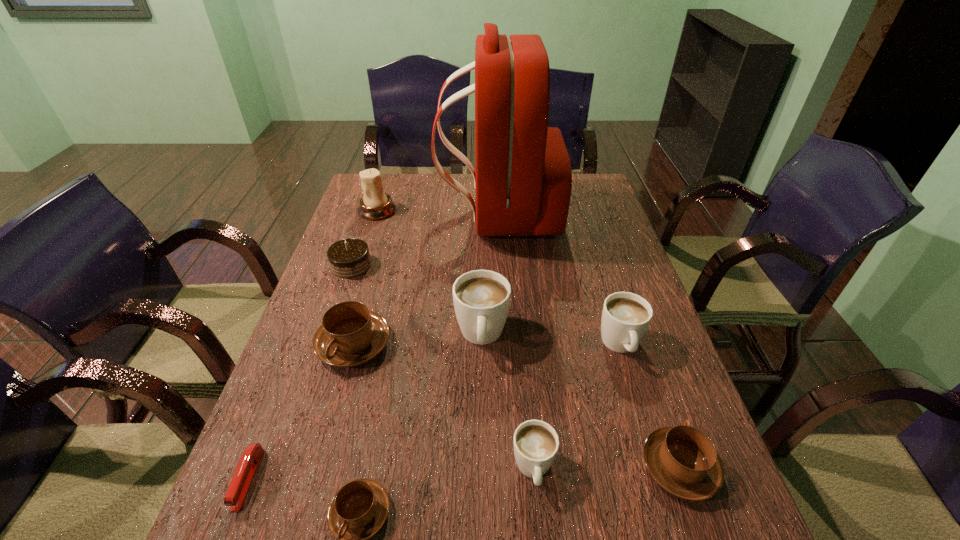
The image size is (960, 540). I want to click on vacant area that lies between the biggest brown cappuccino and the nearest white cappuccino, so click(444, 406).

Image resolution: width=960 pixels, height=540 pixels. In order to click on vacant area that lies between the stapler and the nearest white cappuccino in this screenshot , I will do `click(391, 474)`.

Where is `object that can be found as the third closest to the ninth tallest object`? object that can be found as the third closest to the ninth tallest object is located at coordinates (350, 335).

You are a GUI agent. You are given a task and a screenshot of the screen. Output one action in this format:
    pyautogui.click(x=<x>, y=<y>)
    Task: Click on the object that stands as the eighth closest to the white candle holder
    The height and width of the screenshot is (540, 960).
    Given the screenshot: What is the action you would take?
    pyautogui.click(x=358, y=510)

Identify which cappuccino is located as the nearest to the tallest object. Please provide its 2D coordinates. Your answer should be formatted as a tuple, i.e. [(x, y)], where the tuple contains the x and y coordinates of a point satisfying the conditions above.

[(481, 298)]

Locate an element on the screen. This screenshot has height=540, width=960. cappuccino object that ranks as the second closest to the nearest white cappuccino is located at coordinates (481, 298).

Locate which white cappuccino is the third closest to the rightmost brown cappuccino. Please provide its 2D coordinates. Your answer should be formatted as a tuple, i.e. [(x, y)], where the tuple contains the x and y coordinates of a point satisfying the conditions above.

[(481, 298)]

Point out which white cappuccino is positioned as the second nearest to the shortest cappuccino. Please provide its 2D coordinates. Your answer should be formatted as a tuple, i.e. [(x, y)], where the tuple contains the x and y coordinates of a point satisfying the conditions above.

[(481, 298)]

Find the location of a particular element. The width and height of the screenshot is (960, 540). the second closest brown cappuccino relative to the fourth tallest object is located at coordinates (350, 335).

Identify which brown cappuccino is the second nearest to the shortest object. Please provide its 2D coordinates. Your answer should be formatted as a tuple, i.e. [(x, y)], where the tuple contains the x and y coordinates of a point satisfying the conditions above.

[(350, 335)]